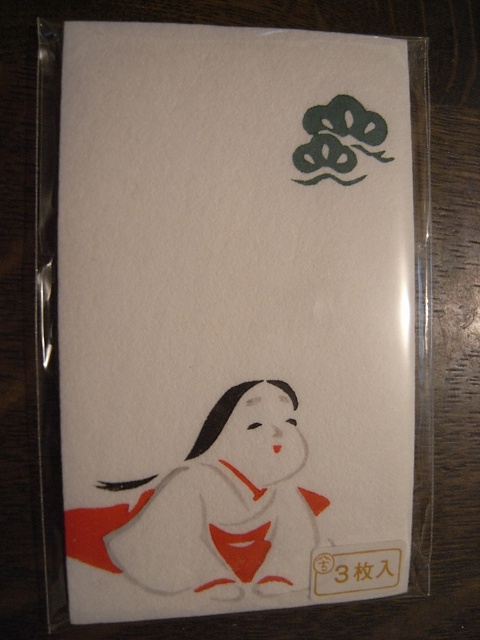
Who is higher up, white paper at center or matte white kimono at lower left?

white paper at center

This screenshot has height=640, width=480. Describe the element at coordinates (233, 317) in the screenshot. I see `white paper at center` at that location.

Which is behind, point (92, 227) or point (168, 524)?

Point (168, 524)

This screenshot has width=480, height=640. Identify the location of white paper at center. (233, 317).